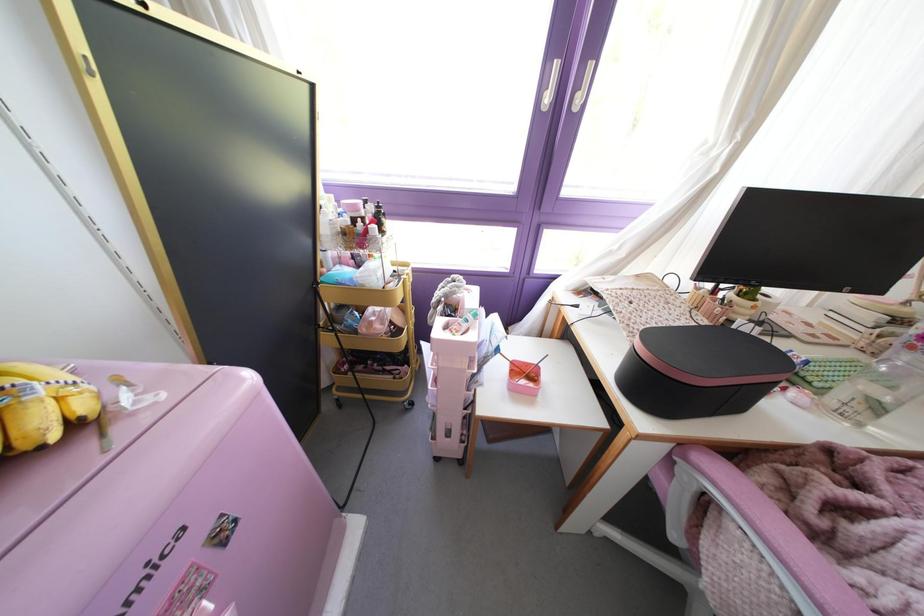
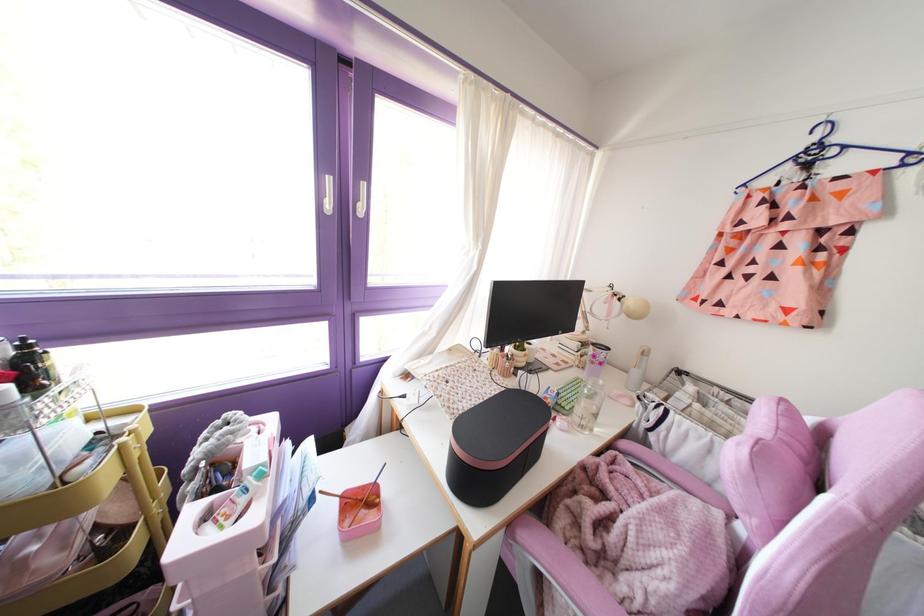
Where in the second image is the point corresponding to (546,99) from the first image?

(329, 205)